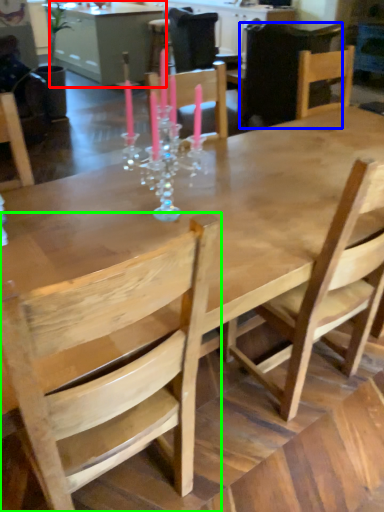
Question: Which is nearer to the table (highlighted by a red box)? chair (highlighted by a blue box) or chair (highlighted by a green box).

Choices:
 (A) chair
 (B) chair

Answer: (A)